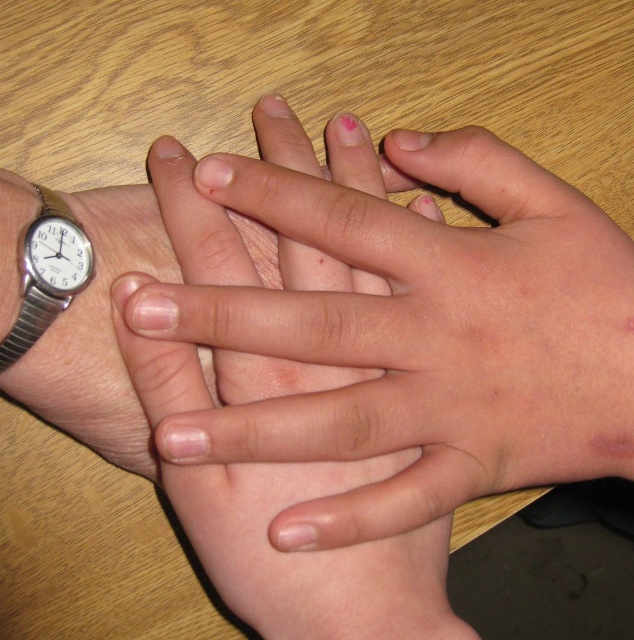
Based on the scene description, where exactly are the smooth skin hands at center located in the image?

The smooth skin hands at center are located at point coordinates of 0.525 on the x axis and 0.661 on the y axis.

You are an observer looking at the two hands on the wooden surface. Which object is closer to you between the silver metallic watch at left and the smooth skin hands at center?

The smooth skin hands at center are closer to you because the silver metallic watch at left is behind them.

You are a photographer setting up a closeup shot of two hands on a wooden table. You need to ensure the silver metallic watch at left and the smooth skin hands at center are both in frame. Based on their positions, which hand should be placed closer to the edge of the table to avoid being cut off?

The smooth skin hands at center should be placed closer to the edge of the table because it is positioned on the right side of the silver metallic watch at left, so moving it toward the edge would keep both hands within the frame.